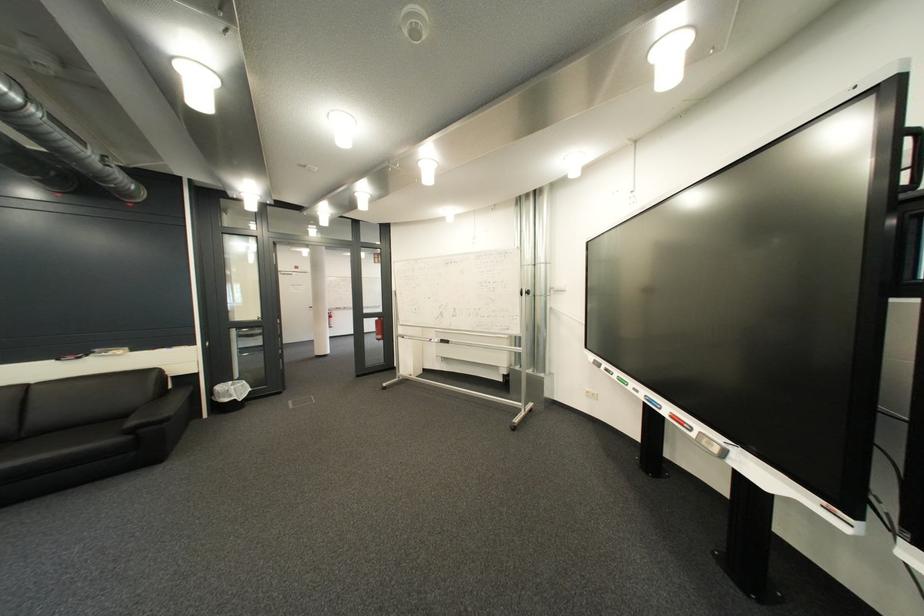
Identify the location of black sofa armrest. This screenshot has height=616, width=924. (128, 384).